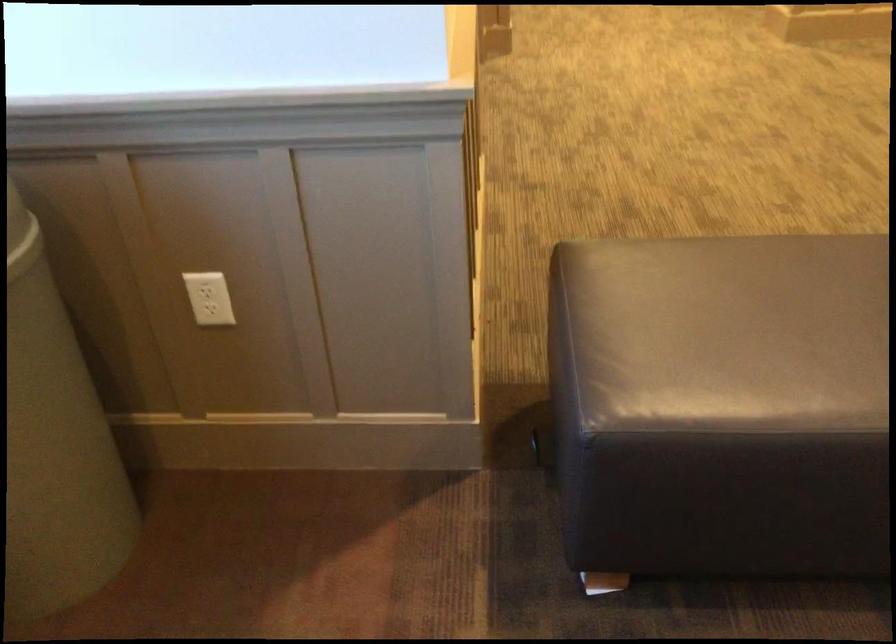
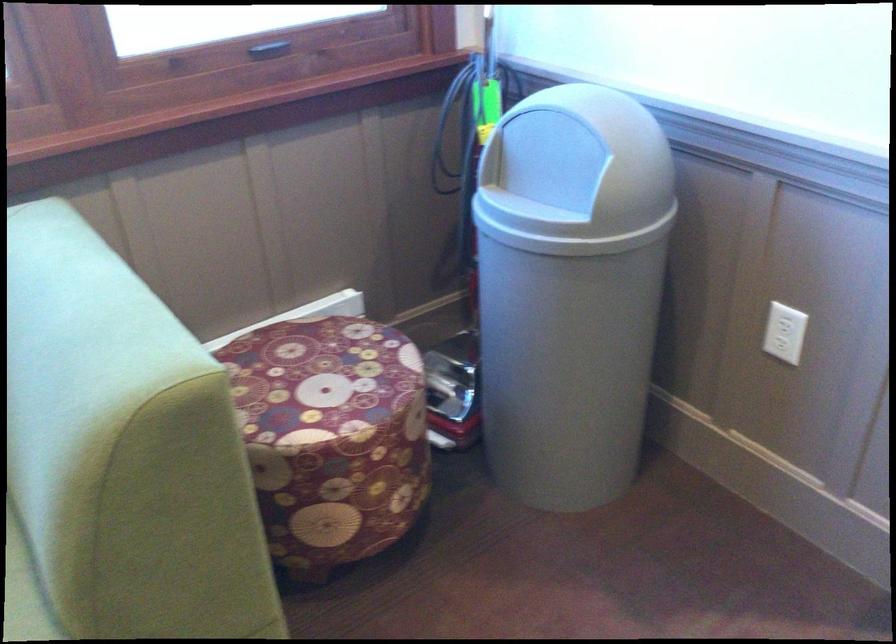
Find the pixel in the second image that matches point 211,299 in the first image.

(787, 328)